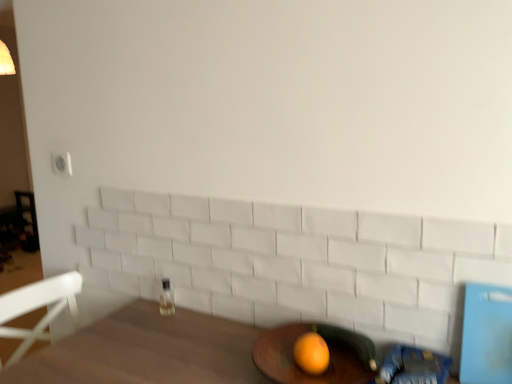
This screenshot has height=384, width=512. I want to click on wooden round table at lower center, so click(295, 362).

Where is `wooden round table at lower center`? The image size is (512, 384). wooden round table at lower center is located at coordinates (295, 362).

Would you say wooden round table at lower center is outside orange matte at lower center?

Yes, wooden round table at lower center is outside of orange matte at lower center.

Does wooden round table at lower center lie behind orange matte at lower center?

No, wooden round table at lower center is closer to the viewer.

From the picture: What's the angular difference between wooden round table at lower center and orange matte at lower center's facing directions?

wooden round table at lower center and orange matte at lower center are facing 0.000211 degrees away from each other.

Between point (167, 308) and point (287, 356), which one is positioned in front?

Positioned in front is point (287, 356).

Does clear glass bottle at center appear on the left side of wooden round table at lower center?

Yes, clear glass bottle at center is to the left of wooden round table at lower center.

Is clear glass bottle at center next to wooden round table at lower center?

No, clear glass bottle at center is not touching wooden round table at lower center.

Looking at this image, from a real-world perspective, which object rests below the other?

From a 3D spatial view, wooden round table at lower center is below.

Is point (270, 349) less distant than point (166, 284)?

Yes, it is.

Considering the positions of objects wooden round table at lower center and clear glass bottle at center in the image provided, who is more to the right, wooden round table at lower center or clear glass bottle at center?

wooden round table at lower center.

Is clear glass bottle at center inside wooden round table at lower center?

Definitely not — clear glass bottle at center is not inside wooden round table at lower center.

Does wooden round table at lower center have a lesser height compared to clear glass bottle at center?

Yes, wooden round table at lower center is shorter than clear glass bottle at center.

Which of these two, orange matte at lower center or wooden round table at lower center, stands taller?

wooden round table at lower center is taller.

Does orange matte at lower center appear on the right side of wooden round table at lower center?

In fact, orange matte at lower center is to the left of wooden round table at lower center.

Between point (310, 334) and point (352, 361), which one is positioned behind?

The point (310, 334) is farther from the camera.

From a real-world perspective, who is located higher, orange matte at lower center or wooden round table at lower center?

orange matte at lower center is physically above.

Is orange matte at lower center in contact with clear glass bottle at center?

No, orange matte at lower center is not in contact with clear glass bottle at center.

Based on their sizes in the image, would you say orange matte at lower center is bigger or smaller than clear glass bottle at center?

In the image, orange matte at lower center appears to be larger than clear glass bottle at center.

In the image, is orange matte at lower center on the left side or the right side of clear glass bottle at center?

From the image, it's evident that orange matte at lower center is to the right of clear glass bottle at center.

Does point (308, 369) appear closer or farther from the camera than point (165, 294)?

Clearly, point (308, 369) is closer to the camera than point (165, 294).

In terms of width, does clear glass bottle at center look wider or thinner when compared to orange matte at lower center?

Considering their sizes, clear glass bottle at center looks slimmer than orange matte at lower center.

Who is taller, clear glass bottle at center or orange matte at lower center?

Standing taller between the two is clear glass bottle at center.

From a real-world perspective, is clear glass bottle at center located beneath orange matte at lower center?

Yes, from a real-world perspective, clear glass bottle at center is below orange matte at lower center.

What's the angular difference between clear glass bottle at center and orange matte at lower center's facing directions?

They differ by 4.1 degrees in their facing directions.

Find the location of a particular element. This screenshot has height=384, width=512. orange above the wooden round table at lower center (from the image's perspective) is located at coordinates (311, 353).

Image resolution: width=512 pixels, height=384 pixels. What are the coordinates of `round table to the right of clear glass bottle at center` in the screenshot? It's located at (295, 362).

When comparing their distances from orange matte at lower center, does wooden round table at lower center or clear glass bottle at center seem closer?

wooden round table at lower center is closer to orange matte at lower center.

Looking at the image, which one is located further to orange matte at lower center, clear glass bottle at center or wooden round table at lower center?

Based on the image, clear glass bottle at center appears to be further to orange matte at lower center.

Estimate the real-world distances between objects in this image. Which object is closer to wooden round table at lower center, clear glass bottle at center or orange matte at lower center?

orange matte at lower center lies closer to wooden round table at lower center than the other object.

Looking at the image, which one is located closer to wooden round table at lower center, orange matte at lower center or clear glass bottle at center?

orange matte at lower center is positioned closer to the anchor wooden round table at lower center.

Considering their positions, is wooden round table at lower center positioned further to clear glass bottle at center than orange matte at lower center?

Among the two, orange matte at lower center is located further to clear glass bottle at center.

From the image, which object appears to be nearer to clear glass bottle at center, orange matte at lower center or wooden round table at lower center?

Based on the image, wooden round table at lower center appears to be nearer to clear glass bottle at center.

Identify the location of orange positioned between wooden round table at lower center and clear glass bottle at center from near to far. This screenshot has height=384, width=512. (311, 353).